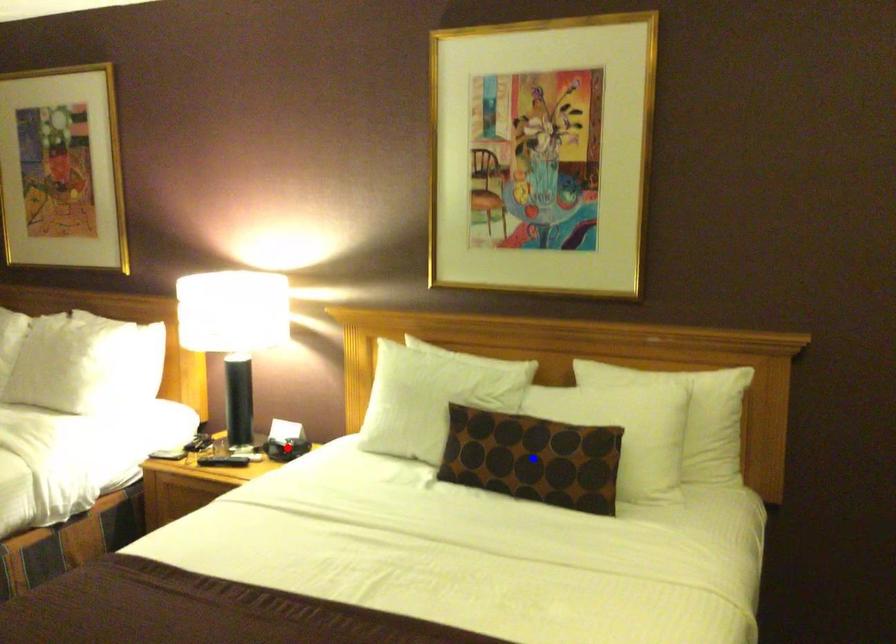
Question: Which of the two points in the image is closer to the camera?

Choices:
 (A) Blue point is closer.
 (B) Red point is closer.

Answer: (A)